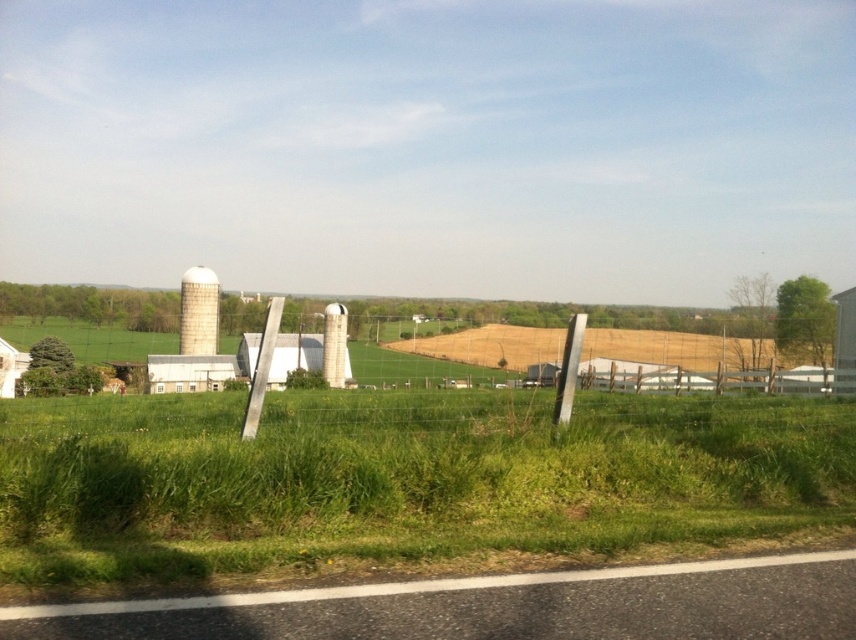
Question: Does green grass at lower center have a greater width compared to white matte silo at upper left?

Choices:
 (A) no
 (B) yes

Answer: (B)

Question: Which object is positioned farthest from the green grass at lower center?

Choices:
 (A) white matte silo at center
 (B) white matte silo at upper left

Answer: (B)

Question: Which of the following is the farthest from the observer?

Choices:
 (A) (342, 369)
 (B) (352, 518)
 (C) (187, 326)

Answer: (C)

Question: Which point appears closest to the camera in this image?

Choices:
 (A) (194, 296)
 (B) (391, 536)
 (C) (331, 368)

Answer: (B)

Question: Can you confirm if white matte silo at upper left is wider than white matte silo at center?

Choices:
 (A) yes
 (B) no

Answer: (A)

Question: Is white matte silo at upper left positioned before white matte silo at center?

Choices:
 (A) yes
 (B) no

Answer: (B)